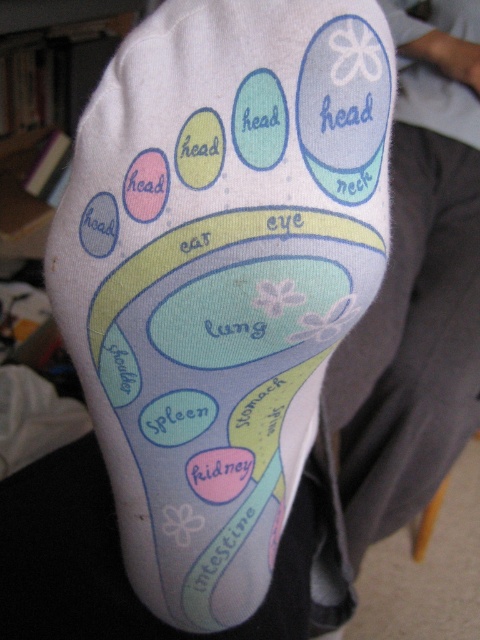
Does white fabric paw print at center have a greater width compared to white fabric at upper right?

Indeed, white fabric paw print at center has a greater width compared to white fabric at upper right.

Does point (317, 72) come farther from viewer compared to point (477, 84)?

No, (317, 72) is closer to viewer.

Where is `white fabric paw print at center`? The height and width of the screenshot is (640, 480). white fabric paw print at center is located at coordinates (220, 275).